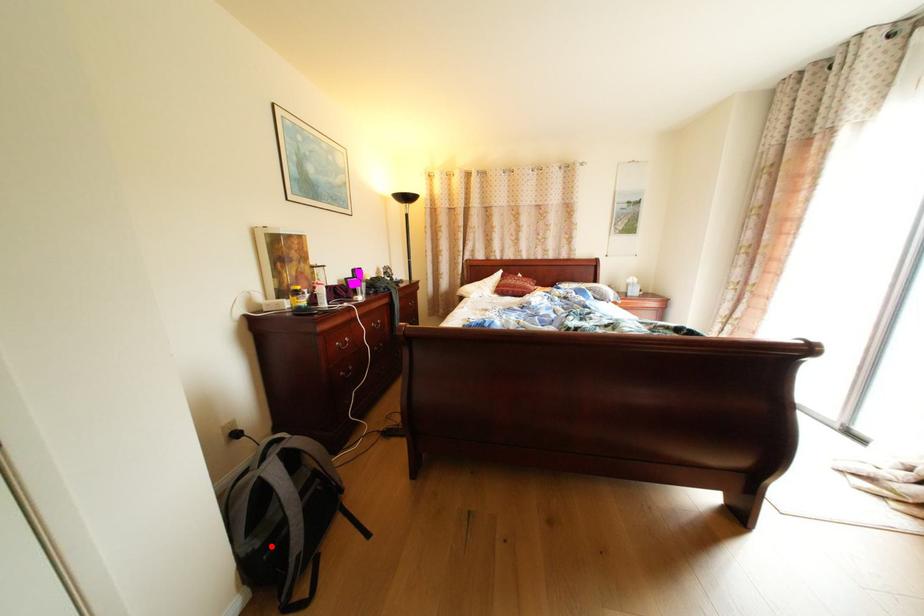
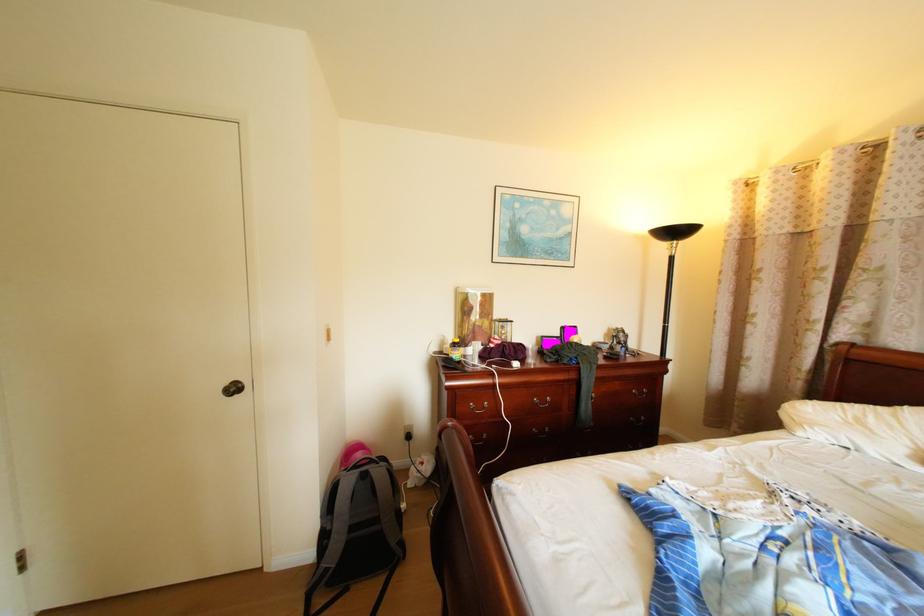
Locate, in the second image, the point that corresponds to the highlighted location in the first image.

(342, 529)